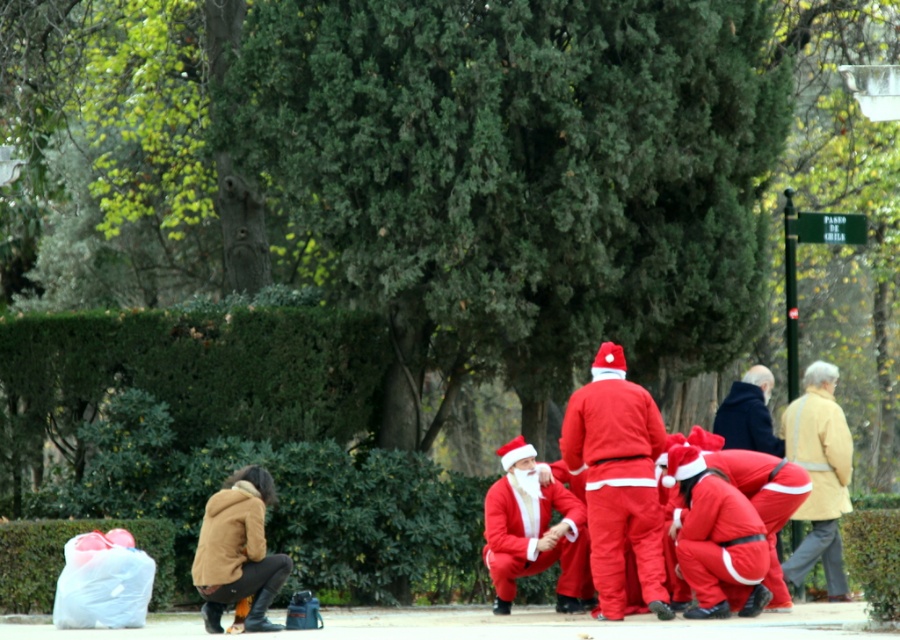
In the scene shown: Who is lower down, matte red santa suit at center or matte red santa at center?

matte red santa at center is below.

Between matte red santa suit at center and matte red santa at center, which one has less height?

With less height is matte red santa at center.

Which is in front, point (603, 484) or point (496, 596)?

Point (603, 484)

Find the location of `matte red santa suit at center`. matte red santa suit at center is located at coordinates tap(617, 481).

Between pavement at lower center and velvet red santa suit at lower right, which one appears on the left side from the viewer's perspective?

From the viewer's perspective, pavement at lower center appears more on the left side.

The image size is (900, 640). What do you see at coordinates (495, 625) in the screenshot?
I see `pavement at lower center` at bounding box center [495, 625].

Measure the distance between point (797,625) and camera.

Point (797,625) is 12.68 meters from camera.

Where is `pavement at lower center`? The image size is (900, 640). pavement at lower center is located at coordinates 495,625.

Between pavement at lower center and matte red santa suit at center, which one has less height?

pavement at lower center is shorter.

From the picture: Which of these two, pavement at lower center or matte red santa suit at center, stands taller?

With more height is matte red santa suit at center.

Which is behind, point (262, 637) or point (636, 483)?

The point (636, 483) is behind.

This screenshot has width=900, height=640. In order to click on pavement at lower center in this screenshot , I will do `click(495, 625)`.